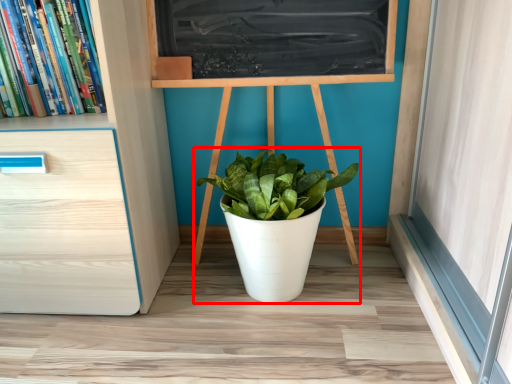
Question: Considering the relative positions of houseplant (annotated by the red box) and book in the image provided, where is houseplant (annotated by the red box) located with respect to the staircase?

Choices:
 (A) left
 (B) right

Answer: (B)